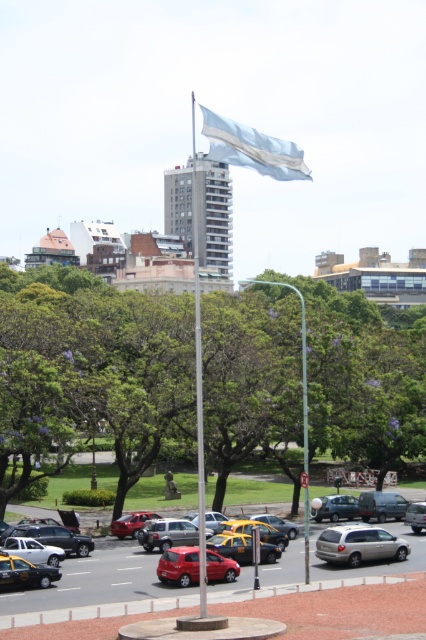
Can you confirm if white glossy flag pole at center is smaller than silver metallic minivan at center?

No, white glossy flag pole at center is not smaller than silver metallic minivan at center.

Is white glossy flag pole at center positioned in front of silver metallic minivan at center?

Yes, it is in front of silver metallic minivan at center.

Does point (193, 260) lie in front of point (391, 547)?

No, it is not.

Where is `white glossy flag pole at center`? This screenshot has width=426, height=640. white glossy flag pole at center is located at coordinates (198, 380).

Who is higher up, white glossy flag pole at center or yellowmattetaxi at center?

Positioned higher is white glossy flag pole at center.

Is point (196, 422) positioned behind point (270, 545)?

Yes, it is behind point (270, 545).

Measure the distance between point (195,273) and camera.

Point (195,273) and camera are 718.62 feet apart.

Where is `white glossy flag pole at center`? The height and width of the screenshot is (640, 426). white glossy flag pole at center is located at coordinates (198, 380).

Which of these two, white glossy flag pole at center or metallic silver sedan at center, stands taller?

white glossy flag pole at center

Between white glossy flag pole at center and metallic silver sedan at center, which one is positioned lower?

metallic silver sedan at center is below.

You are a GUI agent. You are given a task and a screenshot of the screen. Output one action in this format:
    pyautogui.click(x=<x>, y=<y>)
    Task: Click on the white glossy flag pole at center
    
    Given the screenshot: What is the action you would take?
    pyautogui.click(x=198, y=380)